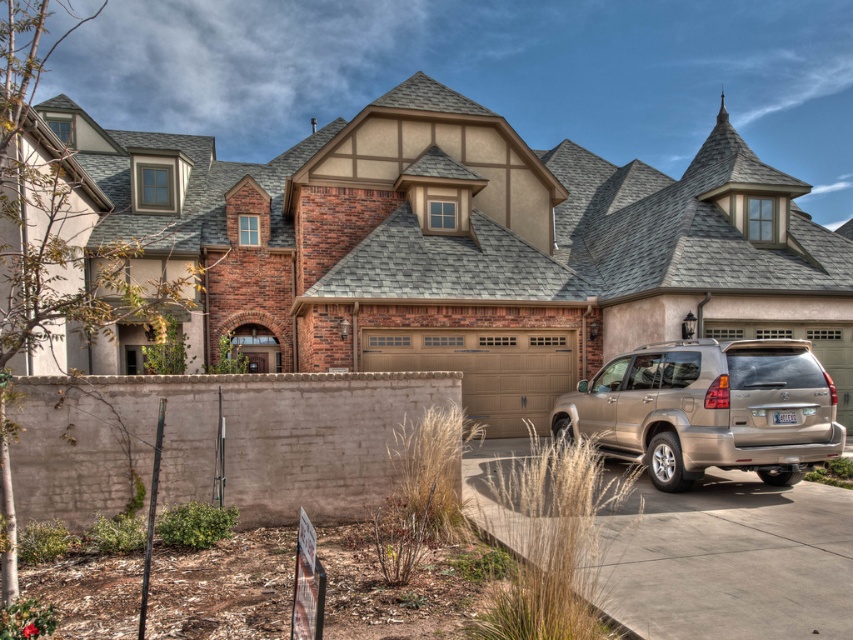
Is gold metallic suv at lower right positioned before tan/glass-like material garage door at center?

Yes, it is.

Does gold metallic suv at lower right have a lesser height compared to tan/glass-like material garage door at center?

Yes, gold metallic suv at lower right is shorter than tan/glass-like material garage door at center.

Who is more distant from viewer, (663, 424) or (521, 433)?

Positioned behind is point (521, 433).

Locate an element on the screen. This screenshot has height=640, width=853. gold metallic suv at lower right is located at coordinates (708, 410).

Measure the distance between concrete at center and tan/glass-like material garage door at center.

concrete at center is 7.15 meters from tan/glass-like material garage door at center.

Does concrete at center have a greater height compared to tan/glass-like material garage door at center?

No, concrete at center is not taller than tan/glass-like material garage door at center.

Is point (815, 540) in front of point (500, 408)?

Yes, point (815, 540) is closer to viewer.

Locate an element on the screen. concrete at center is located at coordinates (728, 561).

Does concrete at center lie in front of gold metallic suv at lower right?

Yes, it is.

Between concrete at center and gold metallic suv at lower right, which one appears on the right side from the viewer's perspective?

Positioned to the right is gold metallic suv at lower right.

Measure the distance between concrete at center and camera.

concrete at center and camera are 6.67 meters apart.

You are a GUI agent. You are given a task and a screenshot of the screen. Output one action in this format:
    pyautogui.click(x=<x>, y=<y>)
    Task: Click on the concrete at center
    This screenshot has height=640, width=853.
    Given the screenshot: What is the action you would take?
    pyautogui.click(x=728, y=561)